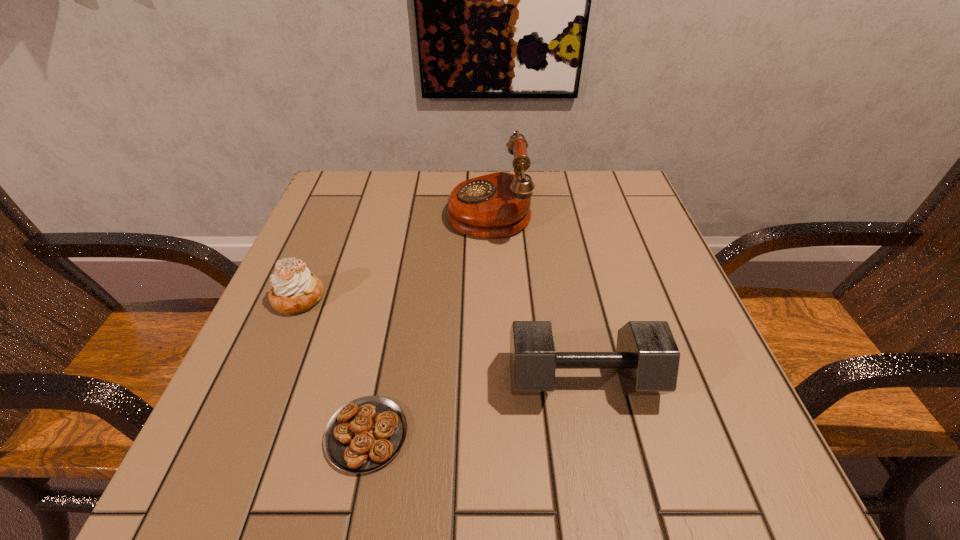
Locate an element on the screen. This screenshot has height=540, width=960. blank space at the far left corner is located at coordinates (352, 209).

This screenshot has height=540, width=960. In order to click on free space at the far right corner of the desktop in this screenshot , I will do `click(630, 200)`.

Image resolution: width=960 pixels, height=540 pixels. Find the location of `unoccupied position between the second object from left to right and the second shortest object`. unoccupied position between the second object from left to right and the second shortest object is located at coordinates (332, 367).

Identify the location of blank region between the leftmost object and the third object from right to left. The width and height of the screenshot is (960, 540). (332, 367).

Where is `blank region between the shortest object and the farthest object`? blank region between the shortest object and the farthest object is located at coordinates (428, 322).

At what (x,y) coordinates should I click in order to perform the action: click on free point between the third shortest object and the left pastry. Please return your answer as a coordinate pair (x, y). The image size is (960, 540). Looking at the image, I should click on (441, 339).

The image size is (960, 540). In order to click on vacant area that lies between the taller pastry and the farthest object in this screenshot , I will do `click(394, 254)`.

This screenshot has height=540, width=960. Identify the location of free space between the second object from left to right and the second tallest object. (475, 407).

This screenshot has width=960, height=540. I want to click on free space between the third shortest object and the nearer pastry, so click(x=475, y=407).

The image size is (960, 540). Identify the location of empty location between the tallest object and the leftmost object. (394, 254).